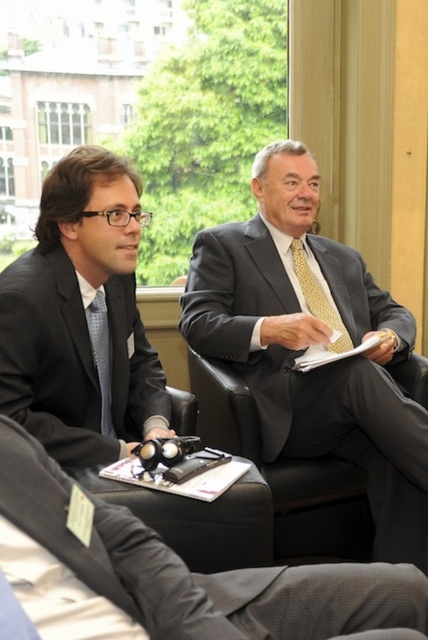
You are organizing a formal event and need to seat two guests wearing the black matte business suit at center and the matte black suit at left. Given their attire sizes, which guest should you seat in a standard chair to ensure comfort?

The black matte business suit at center is smaller than the matte black suit at left, so the guest wearing the black matte business suit at center should be seated in a standard chair to ensure comfort.

You are standing in a conference room and need to reach the black matte business suit at center. The suit is placed on a chair. If your arm can reach 30 inches, can you grab it without moving from your current position?

The black matte business suit at center is 33.06 inches away from the viewer. Since your arm can only reach 30 inches, you cannot grab it without moving from your current position.